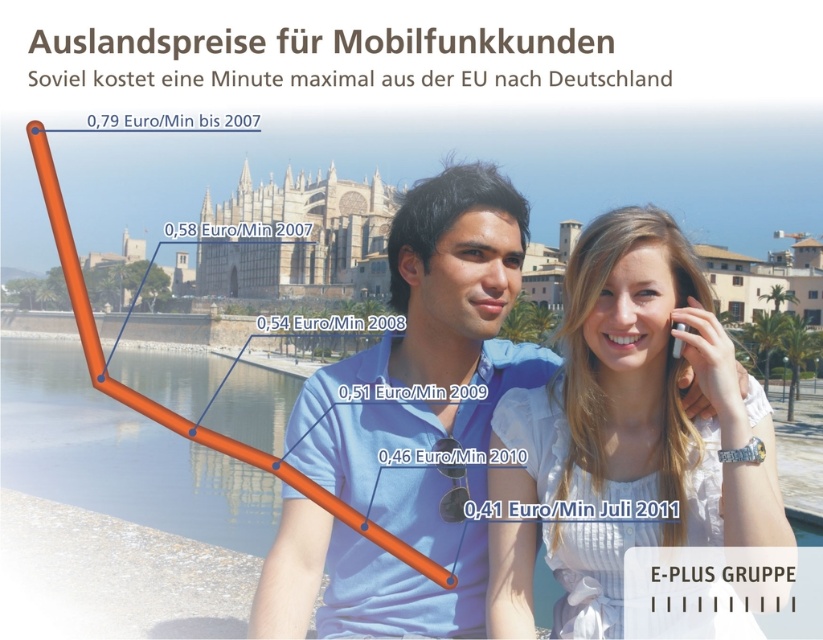
Question: Observing the image, what is the correct spatial positioning of white glossy phone at upper right in reference to white plastic phone at upper right?

Choices:
 (A) right
 (B) left

Answer: (B)

Question: Which of the following is the farthest from the observer?

Choices:
 (A) (466, 310)
 (B) (675, 346)

Answer: (A)

Question: Estimate the real-world distances between objects in this image. Which object is closer to the white plastic phone at upper right?

Choices:
 (A) light blue shirt at center
 (B) white glossy phone at upper right

Answer: (B)

Question: Which object is farther from the camera taking this photo?

Choices:
 (A) white plastic phone at upper right
 (B) white glossy phone at upper right

Answer: (A)

Question: Observing the image, what is the correct spatial positioning of white glossy phone at upper right in reference to light blue shirt at center?

Choices:
 (A) left
 (B) right

Answer: (B)

Question: Observing the image, what is the correct spatial positioning of white glossy phone at upper right in reference to white plastic phone at upper right?

Choices:
 (A) below
 (B) above

Answer: (A)